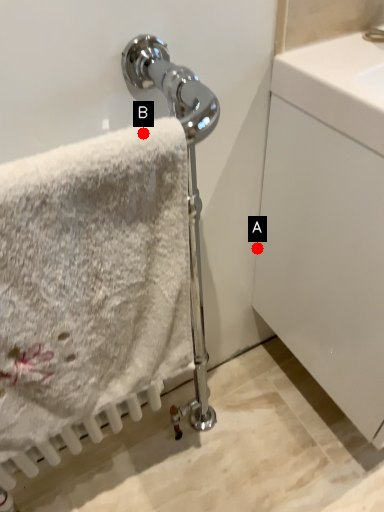
Question: Two points are circled on the image, labeled by A and B beside each circle. Which point is closer to the camera?

Choices:
 (A) A is closer
 (B) B is closer

Answer: (B)